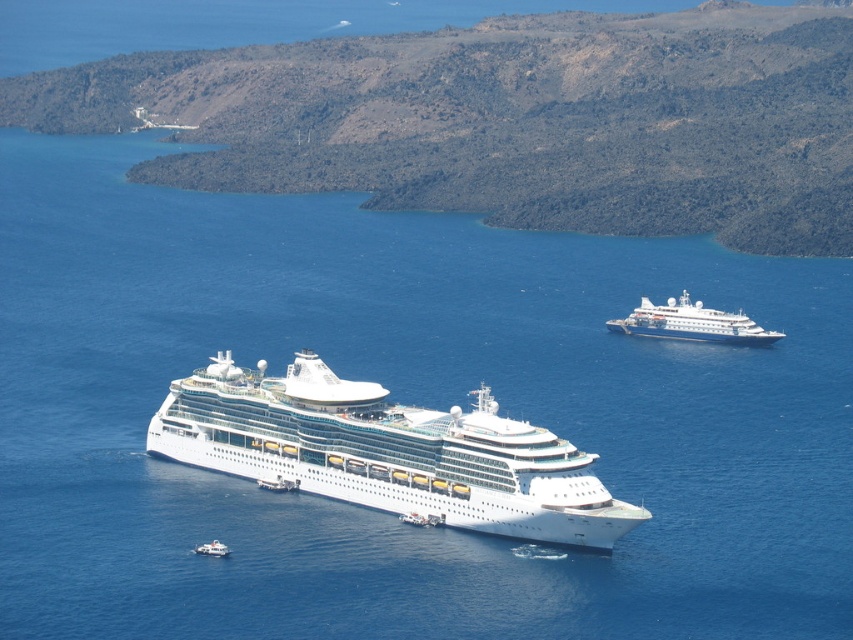
Question: Where is white glossy cruise ship at center located in relation to white glossy boat at lower left in the image?

Choices:
 (A) right
 (B) left

Answer: (A)

Question: Is the position of white glossy cruise ship at center less distant than that of white glossy boat at lower left?

Choices:
 (A) yes
 (B) no

Answer: (A)

Question: Estimate the real-world distances between objects in this image. Which object is closer to the white glossy cruise ship at center?

Choices:
 (A) white glossy boat at lower left
 (B) white glossy cruise ship at upper right

Answer: (A)

Question: Is white glossy cruise ship at center above white glossy boat at lower left?

Choices:
 (A) yes
 (B) no

Answer: (A)

Question: Which point is farther to the camera?

Choices:
 (A) white glossy cruise ship at upper right
 (B) white glossy cruise ship at center
 (C) white glossy boat at lower left

Answer: (A)

Question: Which is farther from the white glossy cruise ship at center?

Choices:
 (A) white glossy boat at lower left
 (B) white glossy cruise ship at upper right

Answer: (B)